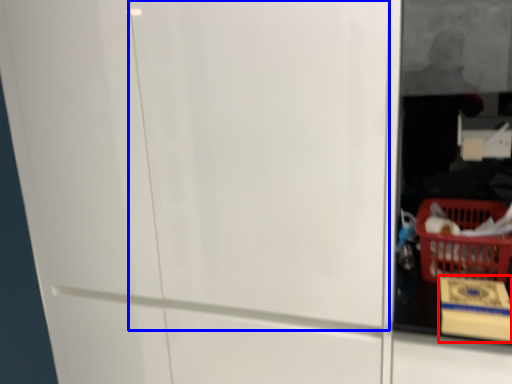
Question: Which object is closer to the camera taking this photo, cardboard box (highlighted by a red box) or screen door (highlighted by a blue box)?

Choices:
 (A) cardboard box
 (B) screen door

Answer: (B)